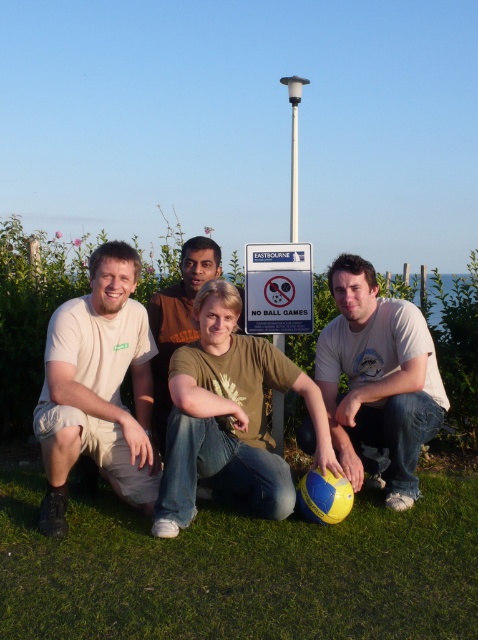
Is green grass at lower center bigger than beige cotton t-shirt at left?

Correct, green grass at lower center is larger in size than beige cotton t-shirt at left.

Which is in front, point (289, 602) or point (105, 352)?

Point (289, 602)

Locate an element on the screen. This screenshot has width=478, height=640. green grass at lower center is located at coordinates (240, 570).

Can you confirm if matte white t-shirt at center is bigger than blue plastic sign at center?

Indeed, matte white t-shirt at center has a larger size compared to blue plastic sign at center.

I want to click on matte white t-shirt at center, so click(378, 381).

Is point (326, 426) less distant than point (64, 506)?

No.

Measure the distance between point (315,403) and camera.

Point (315,403) and camera are 3.74 meters apart from each other.

Who is more distant from viewer, (221, 396) or (139, 506)?

The point (221, 396) is behind.

The width and height of the screenshot is (478, 640). I want to click on volleyball at center, so click(229, 419).